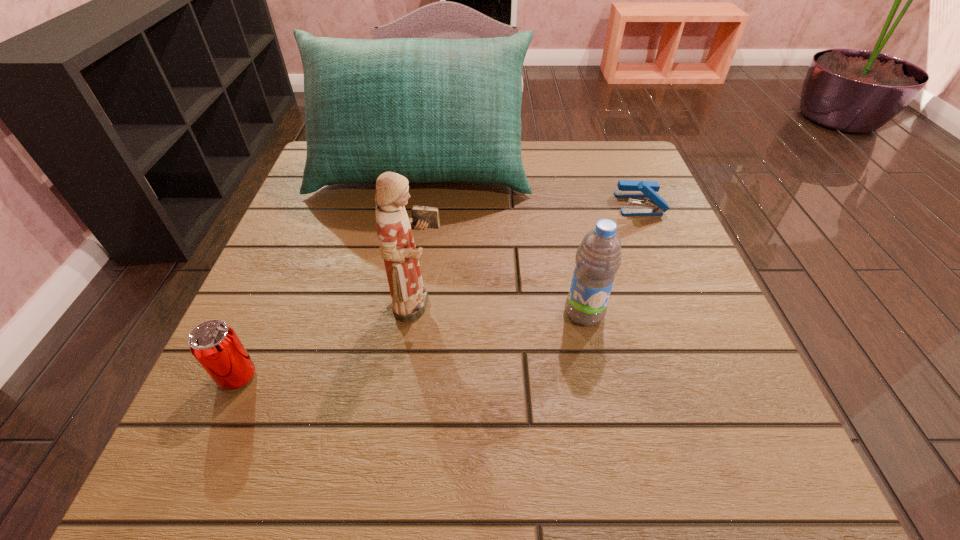
The image size is (960, 540). What are the coordinates of `cushion` in the screenshot? It's located at (432, 110).

The width and height of the screenshot is (960, 540). What are the coordinates of `figurine` in the screenshot? It's located at (397, 245).

In order to click on the fourth object from left to right in this screenshot , I will do `click(598, 258)`.

Identify the location of water bottle. (598, 258).

This screenshot has width=960, height=540. What are the coordinates of `the second shortest object` in the screenshot? It's located at (215, 345).

Locate an element on the screen. the nearest object is located at coordinates (215, 345).

Identify the location of the shortest object. The width and height of the screenshot is (960, 540). (627, 188).

The height and width of the screenshot is (540, 960). Identify the location of the rightmost object. (627, 188).

Locate an element on the screen. blank space located 0.400m on the front-facing side of the cushion is located at coordinates (388, 364).

You are a GUI agent. You are given a task and a screenshot of the screen. Output one action in this format:
    pyautogui.click(x=<x>, y=<y>)
    Task: Click on the free location located 0.140m on the front-facing side of the figurine
    
    Given the screenshot: What is the action you would take?
    pyautogui.click(x=525, y=305)